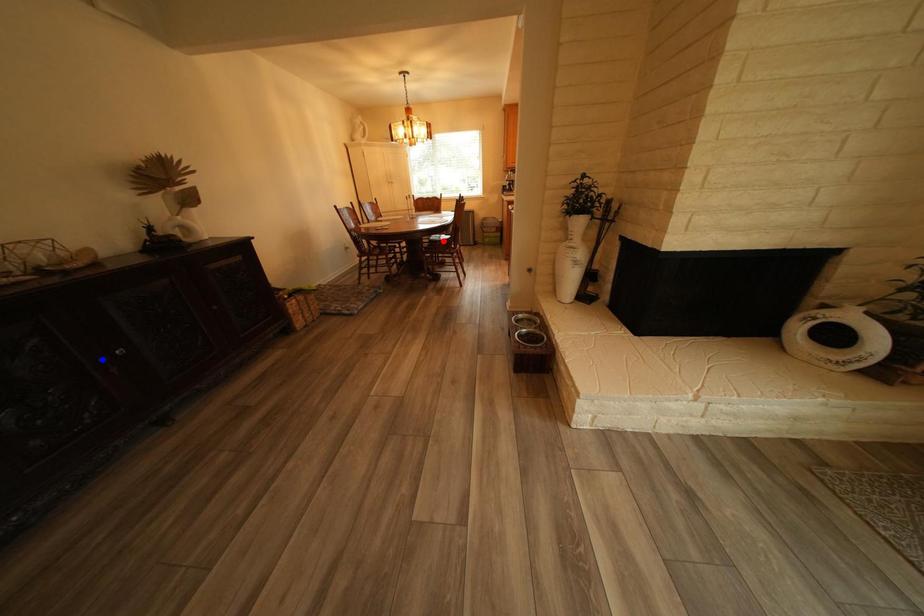
Question: Which of the two points in the image is closer to the camera?

Choices:
 (A) Blue point is closer.
 (B) Red point is closer.

Answer: (A)